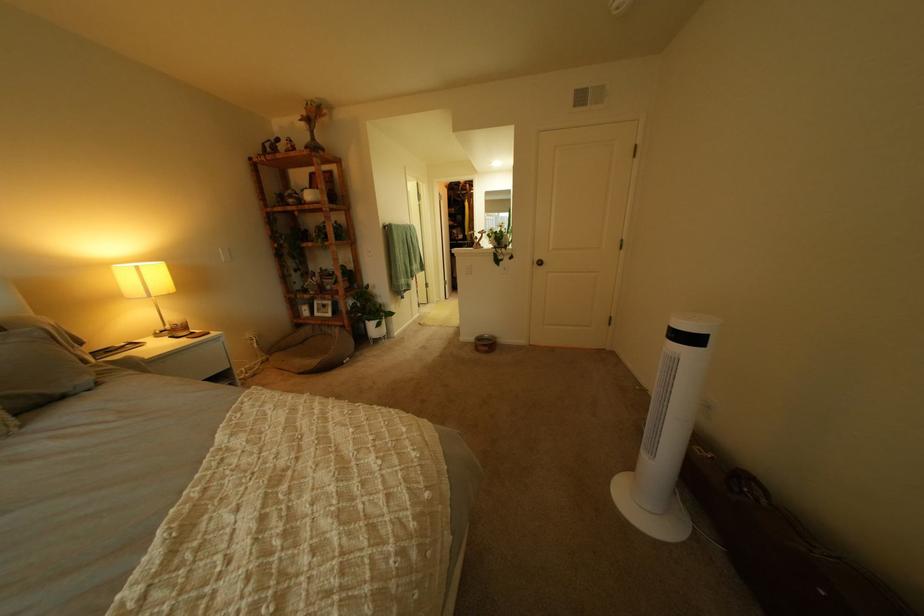
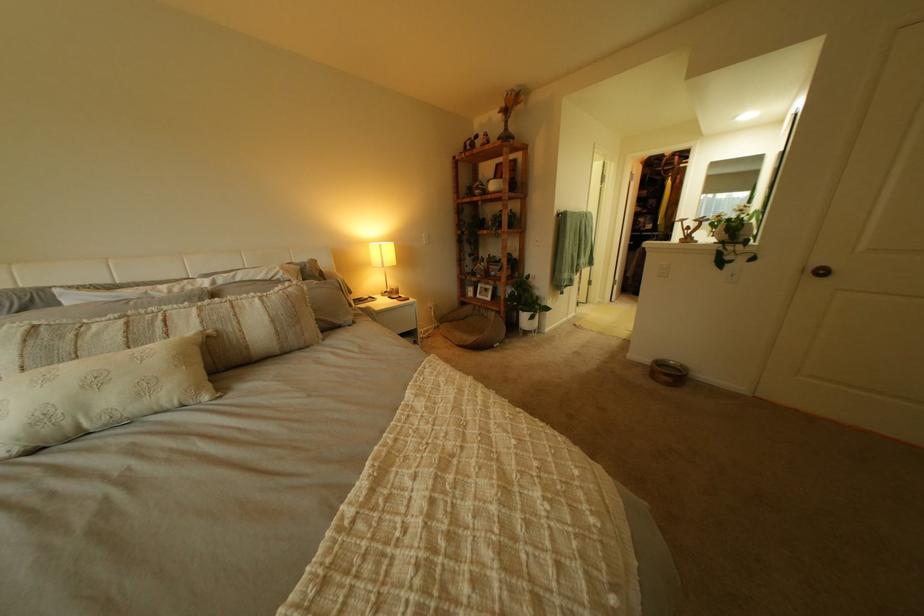
Where in the second image is the point corresponding to point (489, 339) from the first image?

(663, 362)